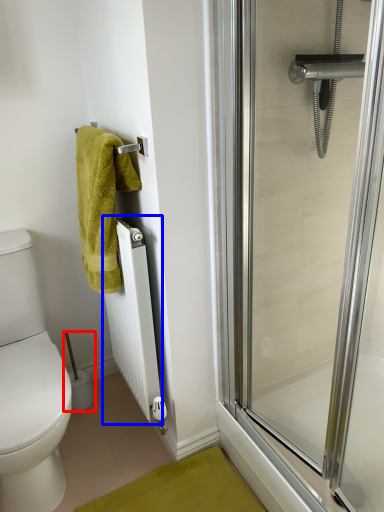
Question: Which point is further to the camera, toilet paper (highlighted by a red box) or radiator (highlighted by a blue box)?

Choices:
 (A) toilet paper
 (B) radiator

Answer: (A)